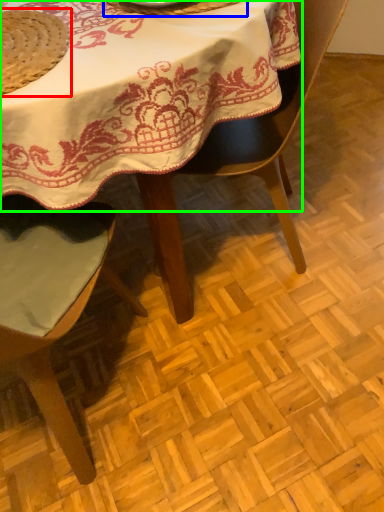
Question: Considering the real-world distances, which object is closest to straw hat (highlighted by a red box)? tableware (highlighted by a blue box) or table (highlighted by a green box).

Choices:
 (A) tableware
 (B) table

Answer: (B)